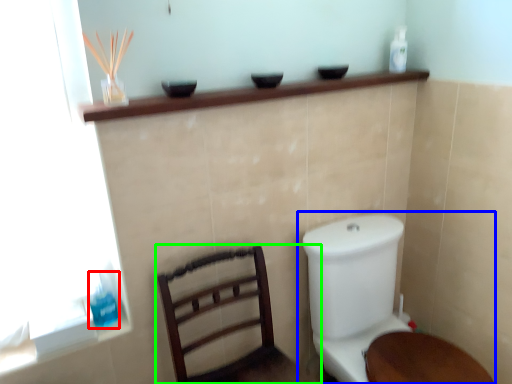
Question: Based on their relative distances, which object is farther from toiletry (highlighted by a red box)? Choose from toilet (highlighted by a blue box) and furniture (highlighted by a green box).

Choices:
 (A) toilet
 (B) furniture

Answer: (A)